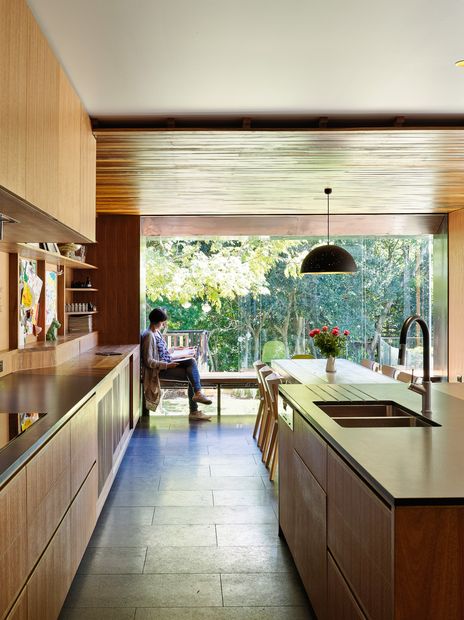
At what (x,y) coordinates should I click in order to perform the action: click on floor. Please return your answer as a coordinate pair (x, y). The width and height of the screenshot is (464, 620). Looking at the image, I should click on (191, 498).